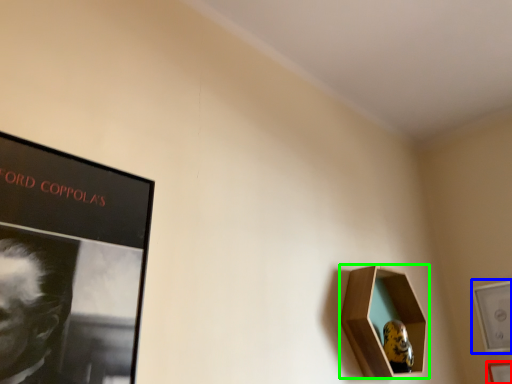
Question: Considering the real-world distances, which object is closest to picture frame (highlighted by a red box)? picture frame (highlighted by a blue box) or picture frame (highlighted by a green box).

Choices:
 (A) picture frame
 (B) picture frame

Answer: (A)